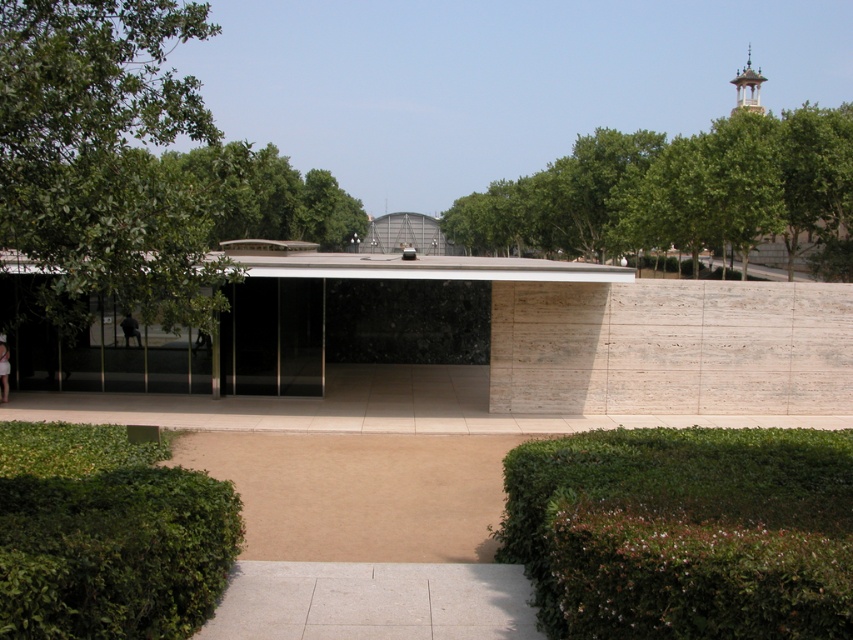
Question: Does green leafy hedge at lower right have a larger size compared to skinny jeans at center?

Choices:
 (A) yes
 (B) no

Answer: (A)

Question: Does green leafy tree at upper center appear on the left side of dark clothing figure at center?

Choices:
 (A) yes
 (B) no

Answer: (A)

Question: Which object is the closest to the skinny jeans at center?

Choices:
 (A) green leafy tree at upper right
 (B) dark blue fabric person at center
 (C) green leafy tree at upper center
 (D) green leafy hedge at lower right

Answer: (B)

Question: Which point appears farthest from the camera in this image?

Choices:
 (A) (131, 324)
 (B) (1, 358)
 (C) (254, 236)
 (D) (718, 436)

Answer: (C)

Question: Among these objects, which one is farthest from the camera?

Choices:
 (A) skinny jeans at center
 (B) black glass door at center
 (C) dark blue fabric person at center

Answer: (C)

Question: Can you confirm if green leafy hedge at lower right is positioned below green leafy tree at upper right?

Choices:
 (A) no
 (B) yes

Answer: (B)